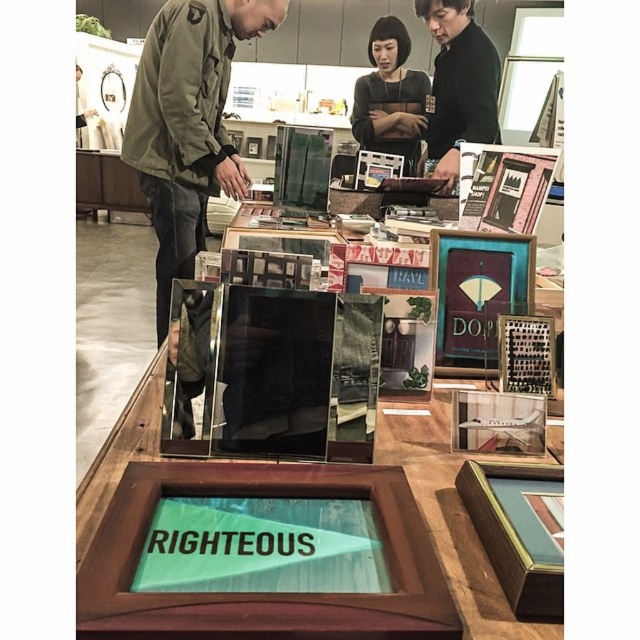
You are trying to decide which jacket to take home from the shop. The green matte jacket at center and the black matte jacket at upper center are both on display. Based on their sizes, which one do you think would be more suitable for a taller person?

The green matte jacket at center is larger in size than the black matte jacket at upper center, so it would be more suitable for a taller person.

You are standing in the shop and want to determine which of the two points, point [451,131] or point [396,115], is nearer to you. Based on the scene description, which point is closer?

Point [451,131] is closer to the viewer than point [396,115].